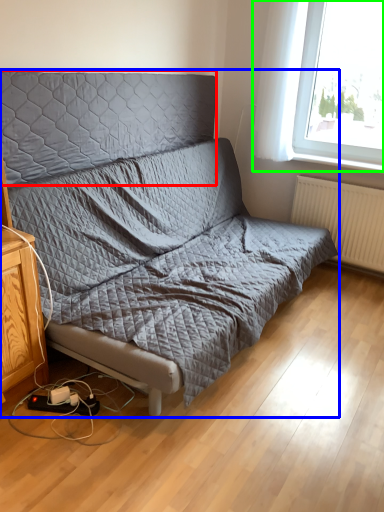
Question: Considering the real-world distances, which object is farthest from headboard (highlighted by a red box)? studio couch (highlighted by a blue box) or window (highlighted by a green box)?

Choices:
 (A) studio couch
 (B) window

Answer: (B)